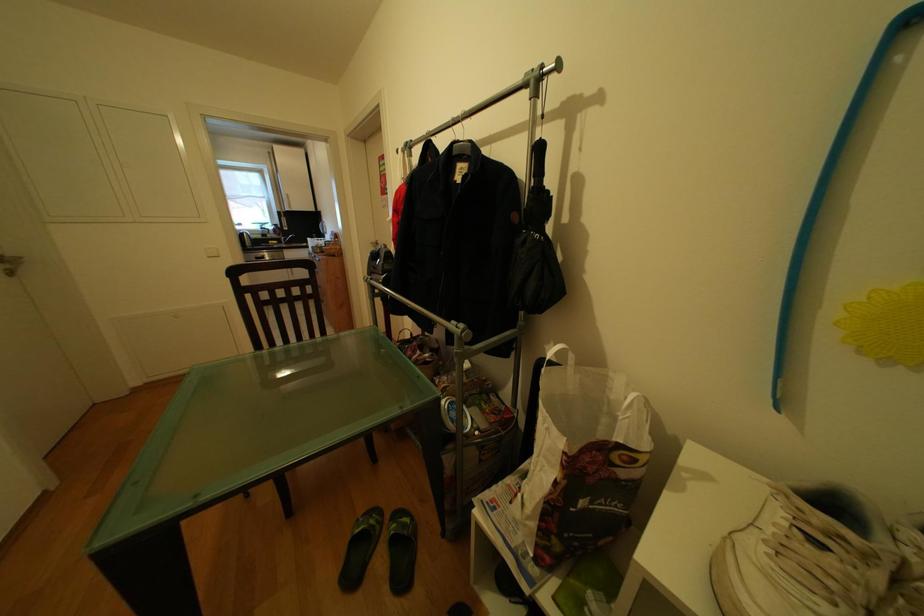
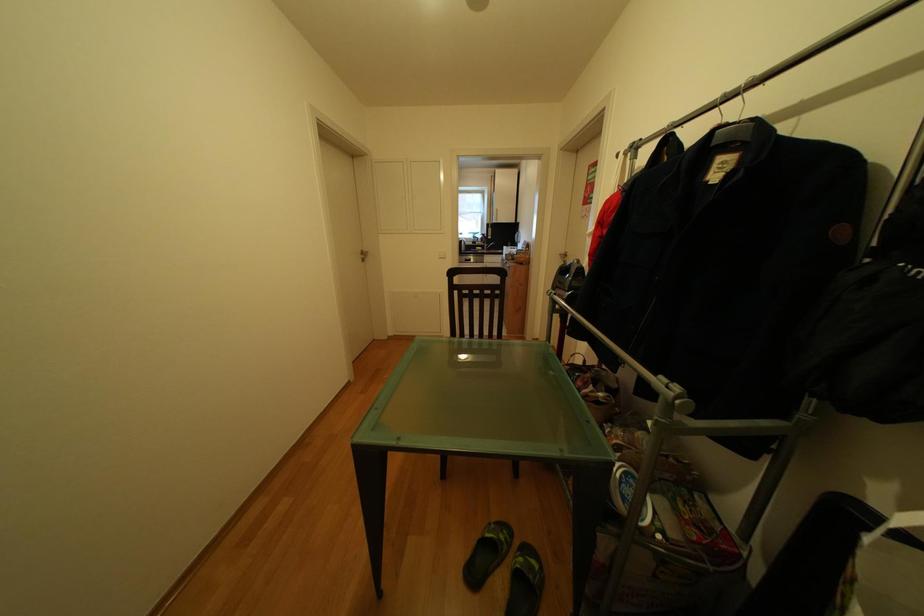
Question: The camera is either moving clockwise (left) or counter-clockwise (right) around the object. The first image is from the beginning of the video and the second image is from the end. Is the camera moving left or right when shooting the video?

Choices:
 (A) Left
 (B) Right

Answer: (B)